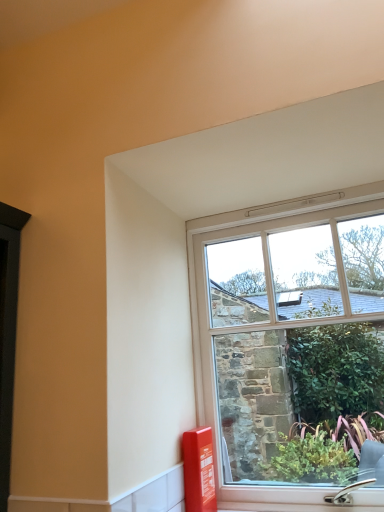
Question: Looking at their shapes, would you say matte red fire extinguisher at lower right is wider or thinner than clear glass window at center?

Choices:
 (A) wide
 (B) thin

Answer: (A)

Question: From a real-world perspective, is matte red fire extinguisher at lower right positioned above or below clear glass window at center?

Choices:
 (A) above
 (B) below

Answer: (B)

Question: Considering the positions of matte red fire extinguisher at lower right and clear glass window at center in the image, is matte red fire extinguisher at lower right taller or shorter than clear glass window at center?

Choices:
 (A) short
 (B) tall

Answer: (A)

Question: Visually, is clear glass window at center positioned to the left or to the right of matte red fire extinguisher at lower right?

Choices:
 (A) right
 (B) left

Answer: (A)

Question: In terms of height, does clear glass window at center look taller or shorter compared to matte red fire extinguisher at lower right?

Choices:
 (A) tall
 (B) short

Answer: (A)

Question: Considering the positions of point (340, 340) and point (195, 464), is point (340, 340) closer or farther from the camera than point (195, 464)?

Choices:
 (A) farther
 (B) closer

Answer: (A)

Question: In terms of width, does clear glass window at center look wider or thinner when compared to matte red fire extinguisher at lower right?

Choices:
 (A) thin
 (B) wide

Answer: (A)